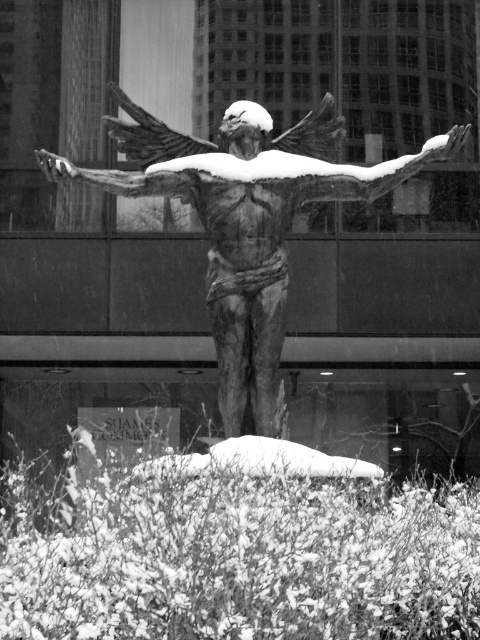
Question: Is rustic stone eagle at center wider than smooth bronze arm at center?

Choices:
 (A) yes
 (B) no

Answer: (A)

Question: Among these objects, which one is farthest from the camera?

Choices:
 (A) smooth bronze arm at center
 (B) rustic stone eagle at center

Answer: (A)

Question: Can you confirm if rustic stone eagle at center is positioned to the right of smooth bronze arm at center?

Choices:
 (A) no
 (B) yes

Answer: (B)

Question: Is rustic stone eagle at center to the right of smooth bronze arm at center from the viewer's perspective?

Choices:
 (A) no
 (B) yes

Answer: (B)